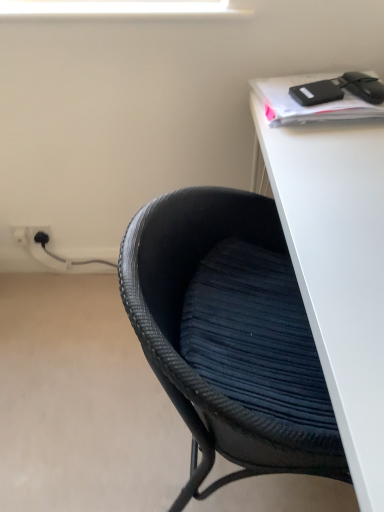
I want to click on vacant space that is to the left of black woven chair at lower left, so click(74, 402).